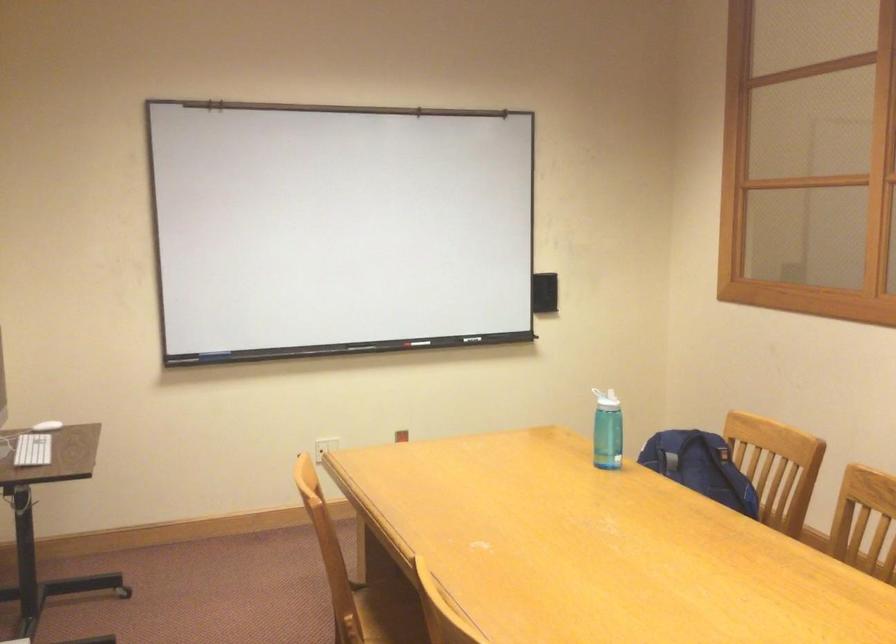
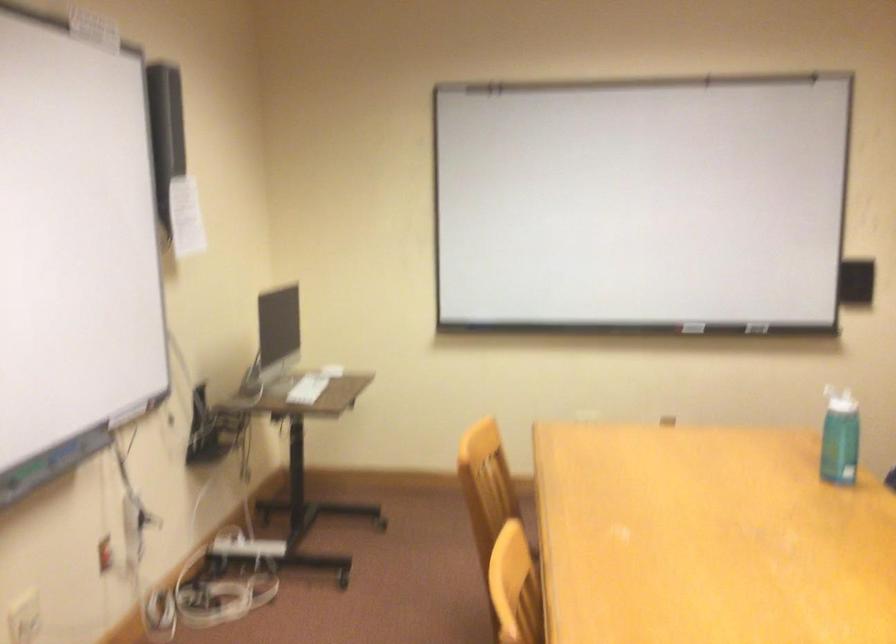
Question: The images are taken continuously from a first-person perspective. In which direction is your viewpoint rotating?

Choices:
 (A) Left
 (B) Right
 (C) Up
 (D) Down

Answer: (A)